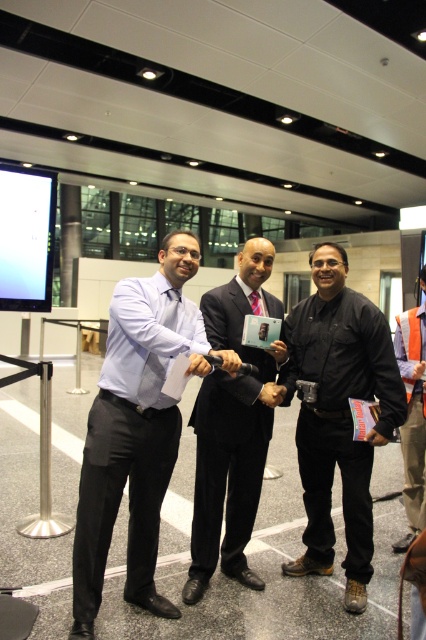
Question: Among these objects, which one is nearest to the camera?

Choices:
 (A) orange safety vest at right
 (B) black leather jacket at center

Answer: (B)

Question: Which point is farther to the camera?

Choices:
 (A) (134, 410)
 (B) (386, 371)

Answer: (B)

Question: Can you confirm if matte blue shirt at center is smaller than black leather jacket at center?

Choices:
 (A) no
 (B) yes

Answer: (B)

Question: Does matte blue shirt at center appear under shiny black suit at center?

Choices:
 (A) yes
 (B) no

Answer: (A)

Question: Is shiny black suit at center further to camera compared to orange safety vest at right?

Choices:
 (A) no
 (B) yes

Answer: (A)

Question: Which object appears closest to the camera in this image?

Choices:
 (A) shiny black suit at center
 (B) matte blue shirt at center
 (C) orange safety vest at right
 (D) black leather jacket at center

Answer: (B)